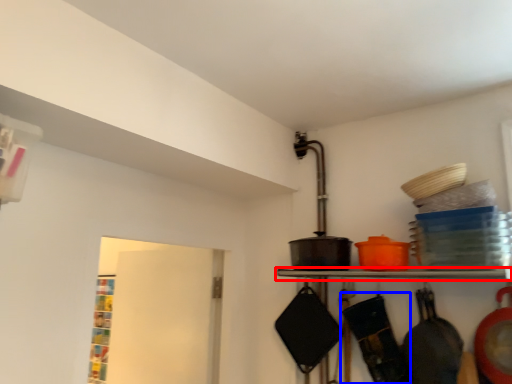
Question: Which object is closer to the camera taking this photo, shelf (highlighted by a red box) or frying pan (highlighted by a blue box)?

Choices:
 (A) shelf
 (B) frying pan

Answer: (A)